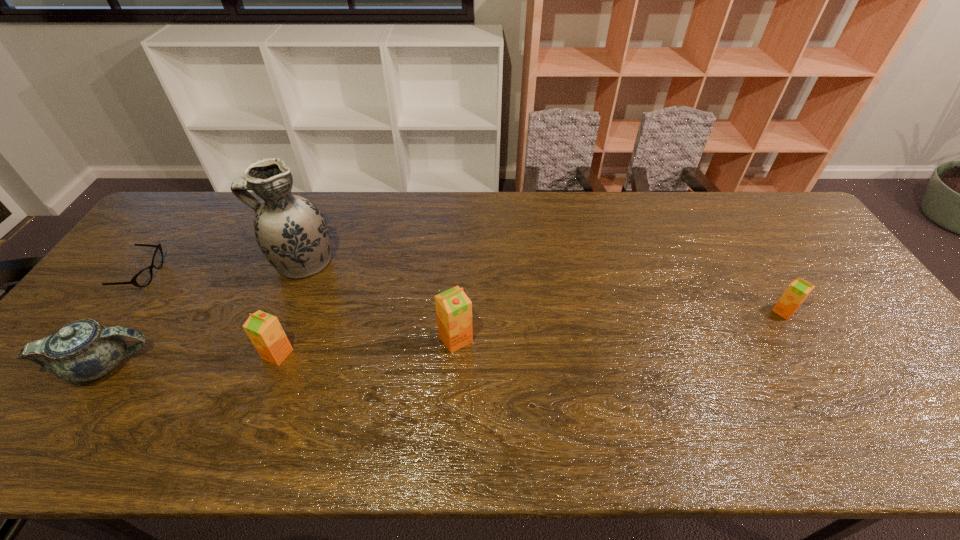
Identify the location of empty space that is in between the chinaware and the vase. (203, 314).

You are a GUI agent. You are given a task and a screenshot of the screen. Output one action in this format:
    pyautogui.click(x=<x>, y=<y>)
    Task: Click on the object that is the nearest to the second tallest orange juice
    This screenshot has height=540, width=960.
    Given the screenshot: What is the action you would take?
    pyautogui.click(x=290, y=230)

Identify which object is the fifth nearest to the vase. Please provide its 2D coordinates. Your answer should be formatted as a tuple, i.e. [(x, y)], where the tuple contains the x and y coordinates of a point satisfying the conditions above.

[(796, 293)]

Identify which orange juice is the second closest to the vase. Please provide its 2D coordinates. Your answer should be formatted as a tuple, i.e. [(x, y)], where the tuple contains the x and y coordinates of a point satisfying the conditions above.

[(453, 308)]

Locate an element on the screen. This screenshot has height=540, width=960. orange juice that is the second nearest to the leftmost orange juice is located at coordinates (796, 293).

Identify the location of free space that satisfies the following two spatial constraints: 1. on the front side of the second tallest object; 2. from the spout of the chinaware. (454, 365).

This screenshot has width=960, height=540. Identify the location of vacant space that satisfies the following two spatial constraints: 1. on the front-facing side of the spectacles; 2. on the left side of the fifth object from left to right. (97, 339).

Identify the location of free space that satisfies the following two spatial constraints: 1. on the front-facing side of the fifth object from left to right; 2. on the left side of the spectacles. (97, 339).